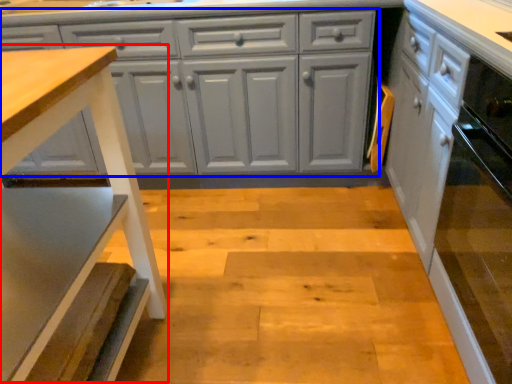
Question: Which object is closer to the camera taking this photo, step stool (highlighted by a red box) or cabinetry (highlighted by a blue box)?

Choices:
 (A) step stool
 (B) cabinetry

Answer: (A)